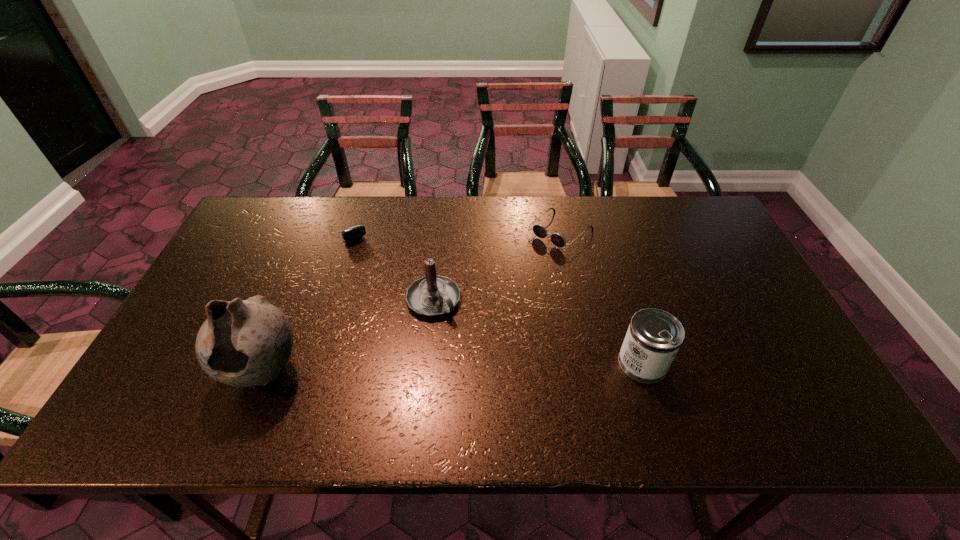
You are a GUI agent. You are given a task and a screenshot of the screen. Output one action in this format:
    pyautogui.click(x=<x>, y=<y>)
    Task: Click on the vacant area at the far edge of the desktop
    
    Given the screenshot: What is the action you would take?
    pyautogui.click(x=484, y=236)

Find the location of a particular element. Image resolution: width=960 pixels, height=540 pixels. vacant space at the near edge of the desktop is located at coordinates (562, 390).

This screenshot has height=540, width=960. I want to click on vacant area at the right edge of the desktop, so click(x=743, y=319).

Identify the location of vacant region at the far left corner. (288, 205).

Locate an element on the screen. Image resolution: width=960 pixels, height=540 pixels. free space at the far right corner is located at coordinates (685, 226).

The image size is (960, 540). Find the location of `vacant point located between the can and the sunglasses`. vacant point located between the can and the sunglasses is located at coordinates (602, 297).

Where is `empty space that is in between the candle and the tallest object`? Image resolution: width=960 pixels, height=540 pixels. empty space that is in between the candle and the tallest object is located at coordinates (348, 335).

The height and width of the screenshot is (540, 960). What are the coordinates of `unoccupied area between the pottery and the candle` in the screenshot? It's located at (348, 335).

The image size is (960, 540). Identify the location of free space between the webcam and the candle. (391, 263).

Where is `unoccupied area between the can and the sunglasses`? The width and height of the screenshot is (960, 540). unoccupied area between the can and the sunglasses is located at coordinates (602, 297).